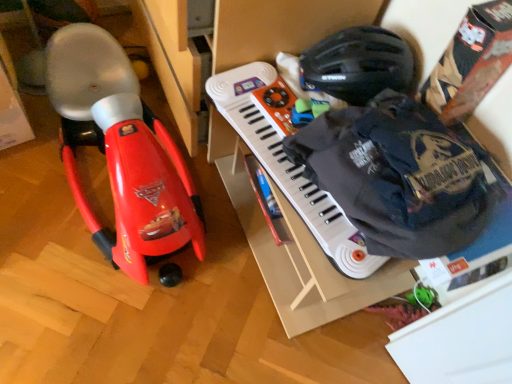
Question: Does point (349, 79) appear closer or farther from the camera than point (128, 66)?

Choices:
 (A) closer
 (B) farther

Answer: (A)

Question: In the image, is black matte helmet at upper right on the left side or the right side of matte red toy car at left?

Choices:
 (A) left
 (B) right

Answer: (B)

Question: Based on their relative distances, which object is farther from the matte red toy car at left?

Choices:
 (A) black matte helmet at upper right
 (B) white plastic musical keyboard at center

Answer: (A)

Question: Considering the real-world distances, which object is farthest from the white plastic musical keyboard at center?

Choices:
 (A) matte red toy car at left
 (B) black matte helmet at upper right

Answer: (A)